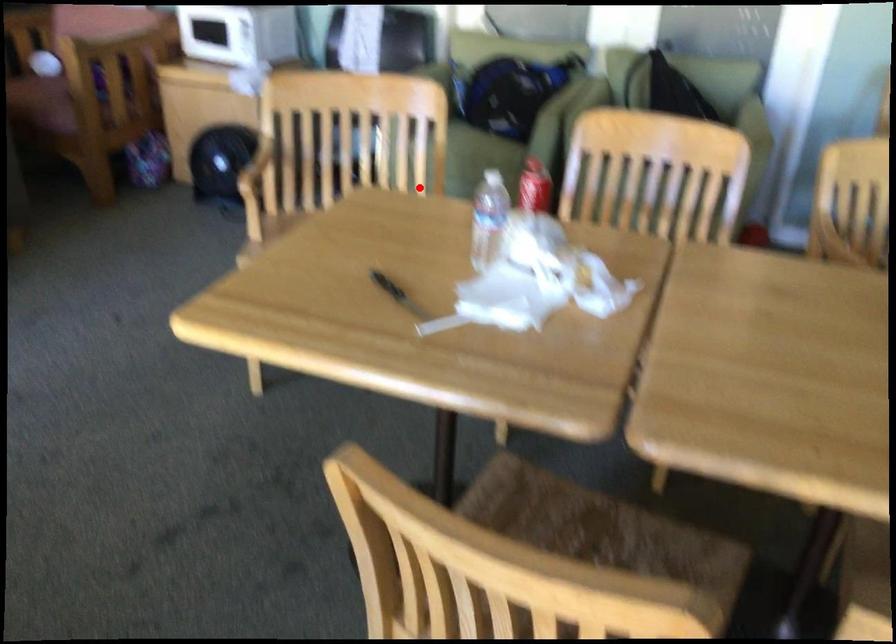
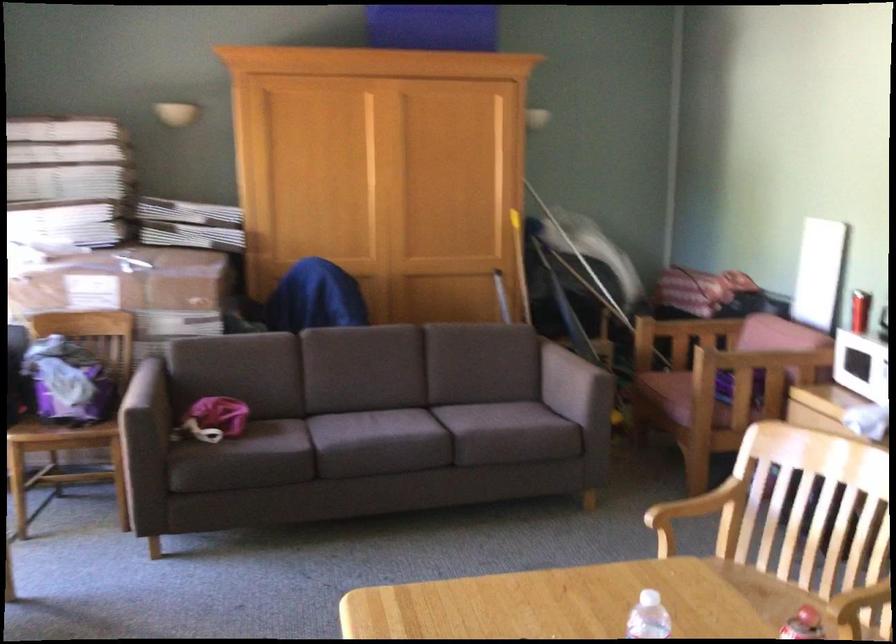
Find the pixel in the second image that matches the highlighted location in the first image.

(860, 609)